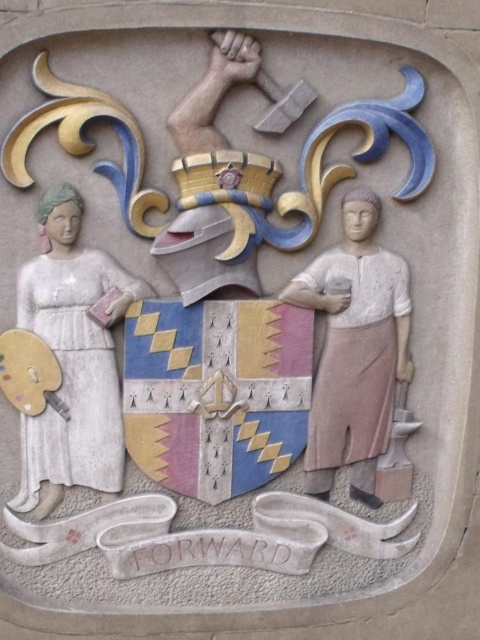
Does smooth white dress at left have a smaller size compared to stone figure at center?

Actually, smooth white dress at left might be larger than stone figure at center.

Is smooth white dress at left wider than stone figure at center?

Indeed, smooth white dress at left has a greater width compared to stone figure at center.

Which is behind, point (41, 336) or point (372, 493)?

The point (372, 493) is behind.

Identify the location of smooth white dress at left. (72, 358).